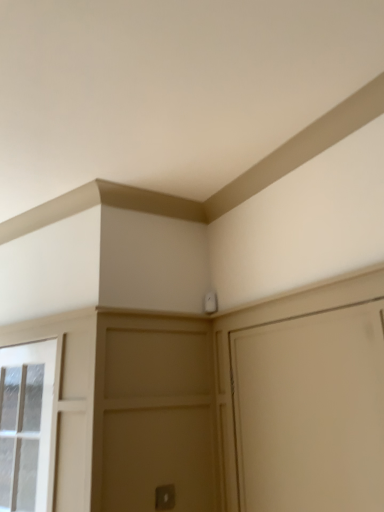
Question: Can you confirm if clear glass window at left is thinner than silver metallic door handle at lower center?

Choices:
 (A) yes
 (B) no

Answer: (B)

Question: From a real-world perspective, does clear glass window at left sit lower than silver metallic door handle at lower center?

Choices:
 (A) yes
 (B) no

Answer: (B)

Question: Can you confirm if clear glass window at left is smaller than silver metallic door handle at lower center?

Choices:
 (A) yes
 (B) no

Answer: (B)

Question: Is clear glass window at left to the left of silver metallic door handle at lower center from the viewer's perspective?

Choices:
 (A) yes
 (B) no

Answer: (A)

Question: Is clear glass window at left far away from silver metallic door handle at lower center?

Choices:
 (A) no
 (B) yes

Answer: (A)

Question: From the image's perspective, is clear glass window at left below silver metallic door handle at lower center?

Choices:
 (A) no
 (B) yes

Answer: (A)

Question: From the image's perspective, is silver metallic door handle at lower center below clear glass window at left?

Choices:
 (A) no
 (B) yes

Answer: (B)

Question: Does silver metallic door handle at lower center have a lesser height compared to clear glass window at left?

Choices:
 (A) no
 (B) yes

Answer: (B)

Question: Is silver metallic door handle at lower center turned away from clear glass window at left?

Choices:
 (A) yes
 (B) no

Answer: (B)

Question: Is silver metallic door handle at lower center taller than clear glass window at left?

Choices:
 (A) no
 (B) yes

Answer: (A)

Question: Does silver metallic door handle at lower center contain clear glass window at left?

Choices:
 (A) no
 (B) yes

Answer: (A)

Question: Considering the relative sizes of silver metallic door handle at lower center and clear glass window at left in the image provided, is silver metallic door handle at lower center smaller than clear glass window at left?

Choices:
 (A) yes
 (B) no

Answer: (A)

Question: Is point (0, 390) positioned closer to the camera than point (157, 492)?

Choices:
 (A) farther
 (B) closer

Answer: (A)